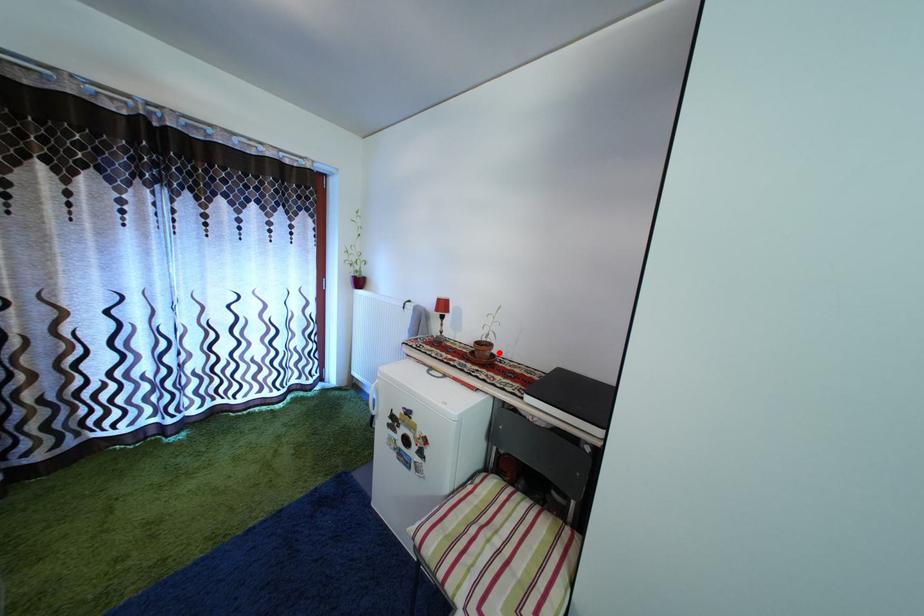
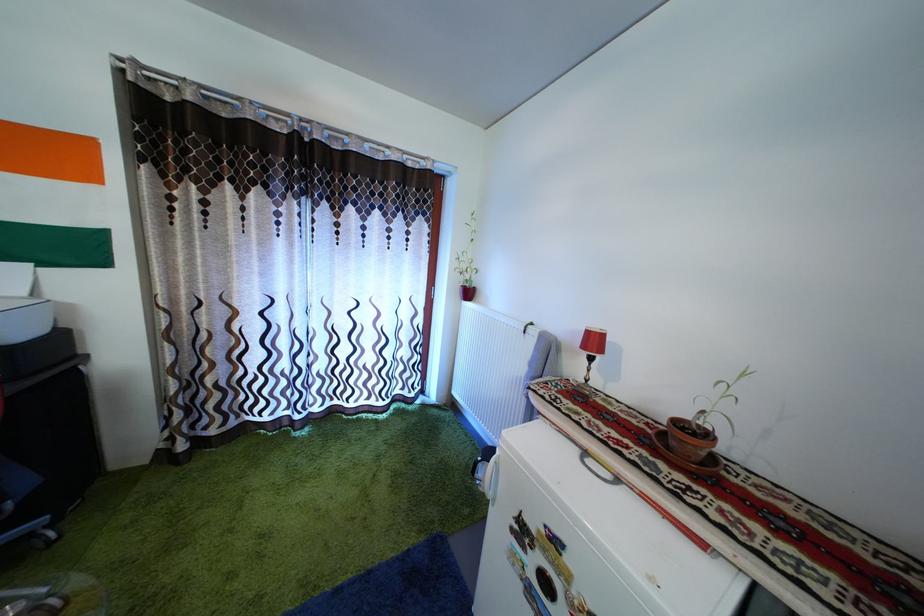
In the second image, find the point that corresponds to the highlighted location in the first image.

(715, 442)